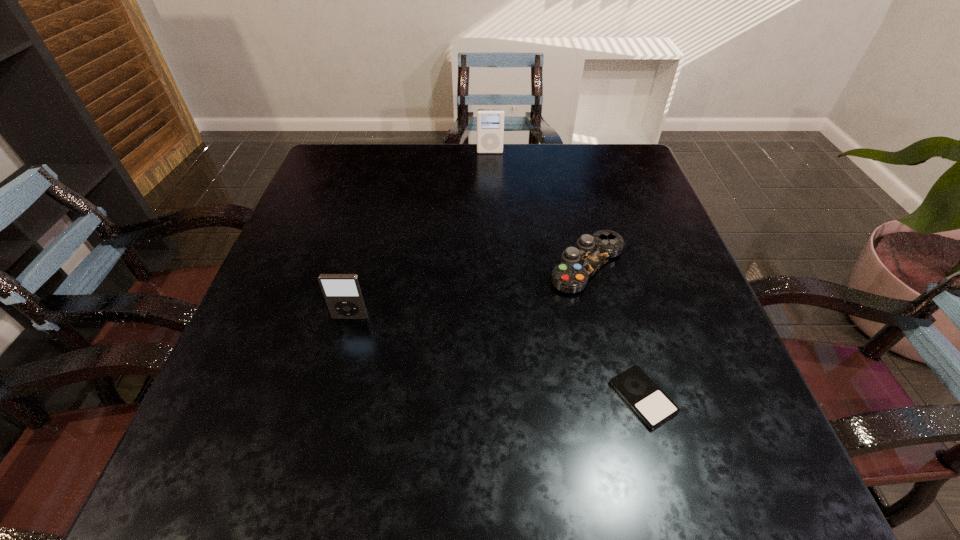
Identify which object is the third closest to the rightmost iPod. Please provide its 2D coordinates. Your answer should be formatted as a tuple, i.e. [(x, y)], where the tuple contains the x and y coordinates of a point satisfying the conditions above.

[(490, 122)]

Identify the location of the second closest object to the second iPod from right to left. This screenshot has width=960, height=540. (342, 292).

Where is `the second closest iPod to the second nearest iPod`? Image resolution: width=960 pixels, height=540 pixels. the second closest iPod to the second nearest iPod is located at coordinates (490, 122).

What are the coordinates of `iPod object that ranks as the closest to the leftmost iPod` in the screenshot? It's located at (650, 403).

Find the location of `free location that satisfies the following two spatial constraints: 1. on the front-facing side of the second farthest iPod; 2. on the right side of the nearest iPod`. free location that satisfies the following two spatial constraints: 1. on the front-facing side of the second farthest iPod; 2. on the right side of the nearest iPod is located at coordinates (330, 397).

What are the coordinates of `vacant position in the image that satisfies the following two spatial constraints: 1. on the front side of the second shortest object; 2. on the left side of the rightmost iPod` in the screenshot? It's located at coord(619,397).

Locate an element on the screen. This screenshot has width=960, height=540. free location that satisfies the following two spatial constraints: 1. on the front-facing side of the shortest object; 2. on the left side of the second nearest iPod is located at coordinates (330, 397).

This screenshot has height=540, width=960. What are the coordinates of `vacant space that satisfies the following two spatial constraints: 1. on the front-facing side of the second farthest object; 2. on the right side of the second object from left to right` in the screenshot? It's located at (493, 265).

This screenshot has width=960, height=540. In order to click on vacant region that satisfies the following two spatial constraints: 1. on the front-facing side of the third object from right to left; 2. on the left side of the shortest object in this screenshot , I will do `click(497, 397)`.

What are the coordinates of `free region that satisfies the following two spatial constraints: 1. on the front side of the third nearest object; 2. on the right side of the shortest iPod` in the screenshot? It's located at (x=619, y=397).